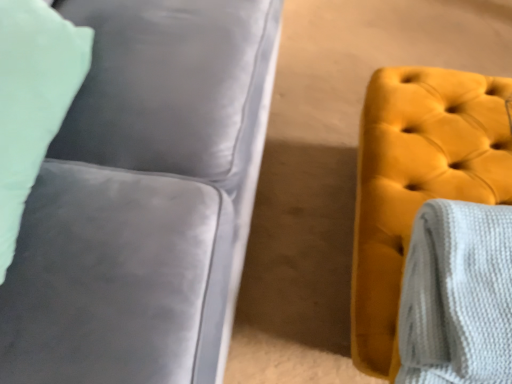
Question: Is white textured blanket at right facing away from satin gray couch at left?

Choices:
 (A) yes
 (B) no

Answer: (B)

Question: Is white textured blanket at right with satin gray couch at left?

Choices:
 (A) no
 (B) yes

Answer: (A)

Question: Is white textured blanket at right to the left of satin gray couch at left from the viewer's perspective?

Choices:
 (A) yes
 (B) no

Answer: (B)

Question: Considering the relative sizes of white textured blanket at right and satin gray couch at left in the image provided, is white textured blanket at right shorter than satin gray couch at left?

Choices:
 (A) yes
 (B) no

Answer: (A)

Question: Does white textured blanket at right appear on the right side of satin gray couch at left?

Choices:
 (A) no
 (B) yes

Answer: (B)

Question: Looking at their shapes, would you say velvet yellow ottoman at right is wider or thinner than white textured blanket at right?

Choices:
 (A) thin
 (B) wide

Answer: (B)

Question: Considering the positions of velvet yellow ottoman at right and white textured blanket at right in the image, is velvet yellow ottoman at right bigger or smaller than white textured blanket at right?

Choices:
 (A) small
 (B) big

Answer: (B)

Question: Considering the positions of point (370, 82) and point (424, 375), is point (370, 82) closer or farther from the camera than point (424, 375)?

Choices:
 (A) closer
 (B) farther

Answer: (B)

Question: From a real-world perspective, relative to white textured blanket at right, is velvet yellow ottoman at right vertically above or below?

Choices:
 (A) below
 (B) above

Answer: (A)

Question: In terms of size, does satin gray couch at left appear bigger or smaller than velvet yellow ottoman at right?

Choices:
 (A) big
 (B) small

Answer: (A)

Question: Is satin gray couch at left taller or shorter than velvet yellow ottoman at right?

Choices:
 (A) short
 (B) tall

Answer: (B)

Question: Based on their positions, is satin gray couch at left located to the left or right of velvet yellow ottoman at right?

Choices:
 (A) left
 (B) right

Answer: (A)

Question: From a real-world perspective, relative to velvet yellow ottoman at right, is satin gray couch at left vertically above or below?

Choices:
 (A) above
 (B) below

Answer: (A)

Question: Is satin gray couch at left wider or thinner than white textured blanket at right?

Choices:
 (A) thin
 (B) wide

Answer: (B)

Question: Do you think satin gray couch at left is within white textured blanket at right, or outside of it?

Choices:
 (A) inside
 (B) outside

Answer: (B)